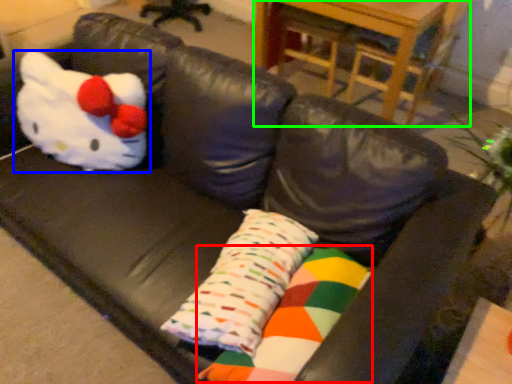
Question: Which object is the closest to the material (highlighted by a red box)? Choose among these: toy (highlighted by a blue box) or table (highlighted by a green box).

Choices:
 (A) toy
 (B) table

Answer: (A)